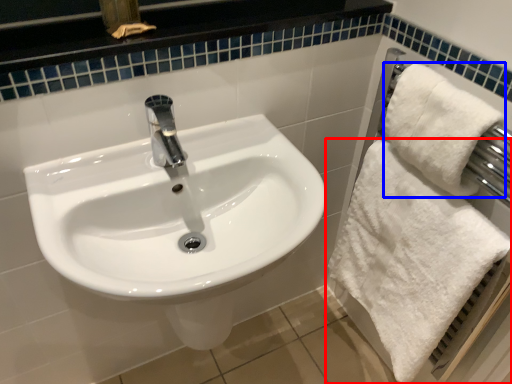
Question: Among these objects, which one is nearest to the camera, towel (highlighted by a red box) or bath towel (highlighted by a blue box)?

Choices:
 (A) towel
 (B) bath towel

Answer: (B)